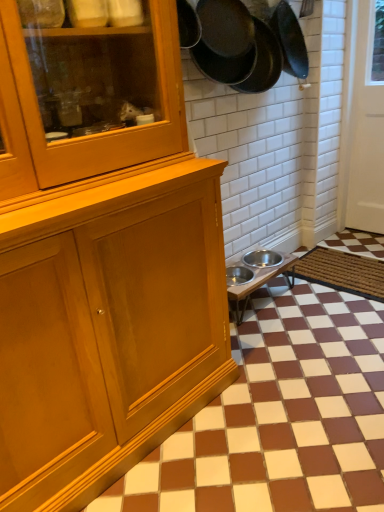
What do you see at coordinates (263, 61) in the screenshot? I see `dark gray matte frying pan at upper right, arranged as the second frying pan when viewed from the left` at bounding box center [263, 61].

In order to click on white glossy door at right in this screenshot , I will do `click(367, 123)`.

Where is `doormat on the right of dark gray matte frying pan at upper right, the first frying pan when ordered from right to left`? doormat on the right of dark gray matte frying pan at upper right, the first frying pan when ordered from right to left is located at coordinates (343, 272).

From a real-world perspective, which is physically above, brown woven mat at lower right or dark gray matte frying pan at upper right, the first frying pan when ordered from right to left?

dark gray matte frying pan at upper right, the first frying pan when ordered from right to left, from a real-world perspective.

Is brown woven mat at lower right wider or thinner than dark gray matte frying pan at upper right, the first frying pan when ordered from right to left?

brown woven mat at lower right is wider than dark gray matte frying pan at upper right, the first frying pan when ordered from right to left.

Which of these two, brown woven mat at lower right or dark gray matte frying pan at upper right, the first frying pan when ordered from right to left, is bigger?

dark gray matte frying pan at upper right, the first frying pan when ordered from right to left, is bigger.

From the image's perspective, would you say brown woven mat at lower right is positioned over brown matte tile at lower right?

Indeed, from the image's perspective, brown woven mat at lower right is shown above brown matte tile at lower right.

Between brown woven mat at lower right and brown matte tile at lower right, which one appears on the left side from the viewer's perspective?

brown matte tile at lower right.

Which is behind, point (367, 273) or point (310, 435)?

The point (367, 273) is farther.

Who is bigger, dark gray matte frying pan at upper right, arranged as the second frying pan when viewed from the left, or metallic stainless steel bowls at lower right?

metallic stainless steel bowls at lower right is bigger.

Is dark gray matte frying pan at upper right, the first frying pan when ordered from right to left, inside or outside of metallic stainless steel bowls at lower right?

The correct answer is: outside.

Is dark gray matte frying pan at upper right, the first frying pan when ordered from right to left, wider or thinner than metallic stainless steel bowls at lower right?

dark gray matte frying pan at upper right, the first frying pan when ordered from right to left, is thinner than metallic stainless steel bowls at lower right.

From a real-world perspective, between dark gray matte frying pan at upper right, the first frying pan when ordered from right to left, and metallic stainless steel bowls at lower right, who is vertically higher?

From a 3D spatial view, dark gray matte frying pan at upper right, the first frying pan when ordered from right to left, is above.

Image resolution: width=384 pixels, height=512 pixels. I want to click on door below the black matte frying pan at upper right, placed as the first frying pan when sorted from left to right (from a real-world perspective), so click(367, 123).

Which object is positioned more to the left, black matte frying pan at upper right, placed as the first frying pan when sorted from left to right, or white glossy door at right?

From the viewer's perspective, black matte frying pan at upper right, placed as the first frying pan when sorted from left to right, appears more on the left side.

Is brown woven mat at lower right situated inside white glossy door at right or outside?

The correct answer is: outside.

Which is nearer, (x=339, y=286) or (x=367, y=139)?

Point (x=339, y=286) appears to be closer to the viewer than point (x=367, y=139).

Are brown woven mat at lower right and white glossy door at right making contact?

No.

From the image's perspective, which object appears higher, brown woven mat at lower right or white glossy door at right?

white glossy door at right appears higher in the image.

Is black matte frying pan at upper right, which ranks as the second frying pan in right-to-left order, facing away from metallic stainless steel bowls at lower right?

No, metallic stainless steel bowls at lower right is not at the back of black matte frying pan at upper right, which ranks as the second frying pan in right-to-left order.

I want to click on table below the black matte frying pan at upper right, placed as the first frying pan when sorted from left to right (from the image's perspective), so click(259, 279).

Is black matte frying pan at upper right, placed as the first frying pan when sorted from left to right, touching metallic stainless steel bowls at lower right?

No.

Is point (226, 18) behind point (290, 266)?

No.

Is white glossy door at right placed right next to dark gray matte frying pan at upper right, arranged as the second frying pan when viewed from the left?

There is a gap between white glossy door at right and dark gray matte frying pan at upper right, arranged as the second frying pan when viewed from the left.

Between white glossy door at right and dark gray matte frying pan at upper right, arranged as the second frying pan when viewed from the left, which one has smaller size?

dark gray matte frying pan at upper right, arranged as the second frying pan when viewed from the left.

Which object is positioned more to the left, white glossy door at right or dark gray matte frying pan at upper right, arranged as the second frying pan when viewed from the left?

dark gray matte frying pan at upper right, arranged as the second frying pan when viewed from the left, is more to the left.

From a real-world perspective, count 1st frying pans upward from the brown woven mat at lower right and point to it. Please provide its 2D coordinates.

[(263, 61)]

This screenshot has width=384, height=512. Find the location of `tile below the brown woven mat at lower right (from the image's perspective)`. tile below the brown woven mat at lower right (from the image's perspective) is located at coordinates (280, 416).

Based on their spatial positions, is dark gray matte frying pan at upper right, arranged as the second frying pan when viewed from the left, or brown woven mat at lower right further from black matte frying pan at upper right, which ranks as the second frying pan in right-to-left order?

brown woven mat at lower right is further to black matte frying pan at upper right, which ranks as the second frying pan in right-to-left order.

Looking at the image, which one is located closer to brown woven mat at lower right, black matte frying pan at upper right, which ranks as the second frying pan in right-to-left order, or brown matte tile at lower right?

brown matte tile at lower right.

Estimate the real-world distances between objects in this image. Which object is further from brown matte tile at lower right, brown woven mat at lower right or dark gray matte frying pan at upper right, arranged as the second frying pan when viewed from the left?

Among the two, dark gray matte frying pan at upper right, arranged as the second frying pan when viewed from the left, is located further to brown matte tile at lower right.

Based on the photo, estimate the real-world distances between objects in this image. Which object is closer to dark gray matte frying pan at upper right, arranged as the second frying pan when viewed from the left, black matte frying pan at upper right, which ranks as the second frying pan in right-to-left order, or metallic stainless steel bowls at lower right?

black matte frying pan at upper right, which ranks as the second frying pan in right-to-left order, lies closer to dark gray matte frying pan at upper right, arranged as the second frying pan when viewed from the left, than the other object.

When comparing their distances from brown woven mat at lower right, does brown matte tile at lower right or metallic stainless steel bowls at lower right seem closer?

metallic stainless steel bowls at lower right is positioned closer to the anchor brown woven mat at lower right.

Consider the image. Based on their spatial positions, is black matte frying pan at upper right, which ranks as the second frying pan in right-to-left order, or brown woven mat at lower right further from brown matte tile at lower right?

black matte frying pan at upper right, which ranks as the second frying pan in right-to-left order, is positioned further to the anchor brown matte tile at lower right.

Estimate the real-world distances between objects in this image. Which object is closer to dark gray matte frying pan at upper right, the first frying pan when ordered from right to left, metallic stainless steel bowls at lower right or brown woven mat at lower right?

metallic stainless steel bowls at lower right is positioned closer to the anchor dark gray matte frying pan at upper right, the first frying pan when ordered from right to left.

From the image, which object appears to be farther from metallic stainless steel bowls at lower right, dark gray matte frying pan at upper right, arranged as the second frying pan when viewed from the left, or black matte frying pan at upper right, placed as the first frying pan when sorted from left to right?

Among the two, black matte frying pan at upper right, placed as the first frying pan when sorted from left to right, is located further to metallic stainless steel bowls at lower right.

The image size is (384, 512). In order to click on doormat between black matte frying pan at upper right, placed as the first frying pan when sorted from left to right, and brown matte tile at lower right vertically in this screenshot , I will do `click(343, 272)`.

At what (x,y) coordinates should I click in order to perform the action: click on door between dark gray matte frying pan at upper right, the first frying pan when ordered from right to left, and metallic stainless steel bowls at lower right, in the vertical direction. Please return your answer as a coordinate pair (x, y). Image resolution: width=384 pixels, height=512 pixels. Looking at the image, I should click on (367, 123).

The width and height of the screenshot is (384, 512). Find the location of `table between brown matte tile at lower right and white glossy door at right from front to back`. table between brown matte tile at lower right and white glossy door at right from front to back is located at coordinates (259, 279).

In order to click on door between dark gray matte frying pan at upper right, the first frying pan when ordered from right to left, and brown matte tile at lower right from top to bottom in this screenshot , I will do [x=367, y=123].